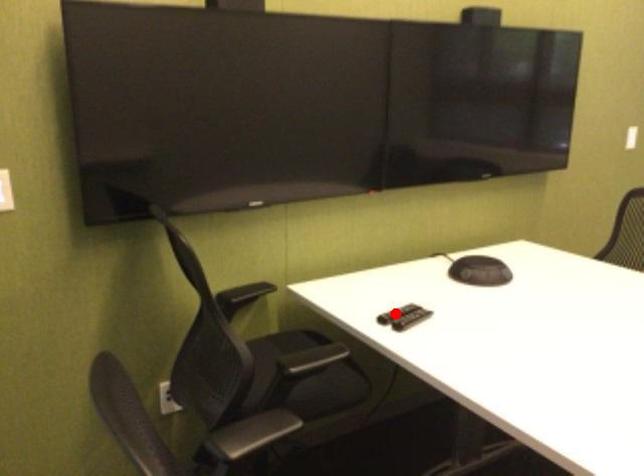
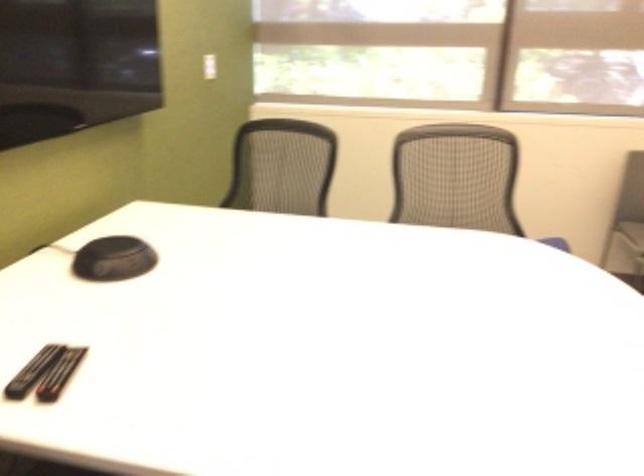
Question: I am providing you with two images of the same scene from different viewpoints. Given a red point in image1, look at the same physical point in image2. Is it:

Choices:
 (A) Closer to the viewpoint
 (B) Farther from the viewpoint

Answer: (A)